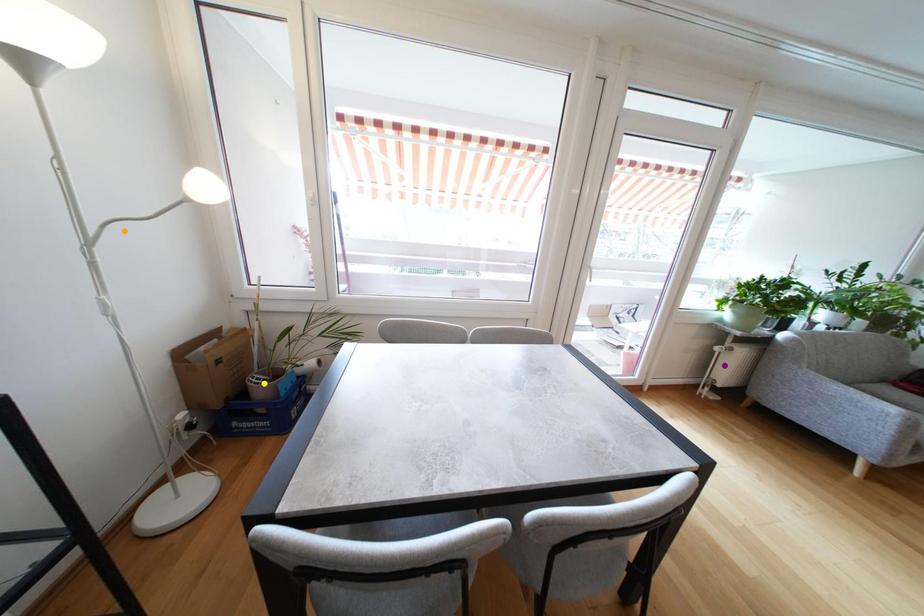
Order these from nearest to farthest:
yellow point | purple point | orange point

orange point
yellow point
purple point